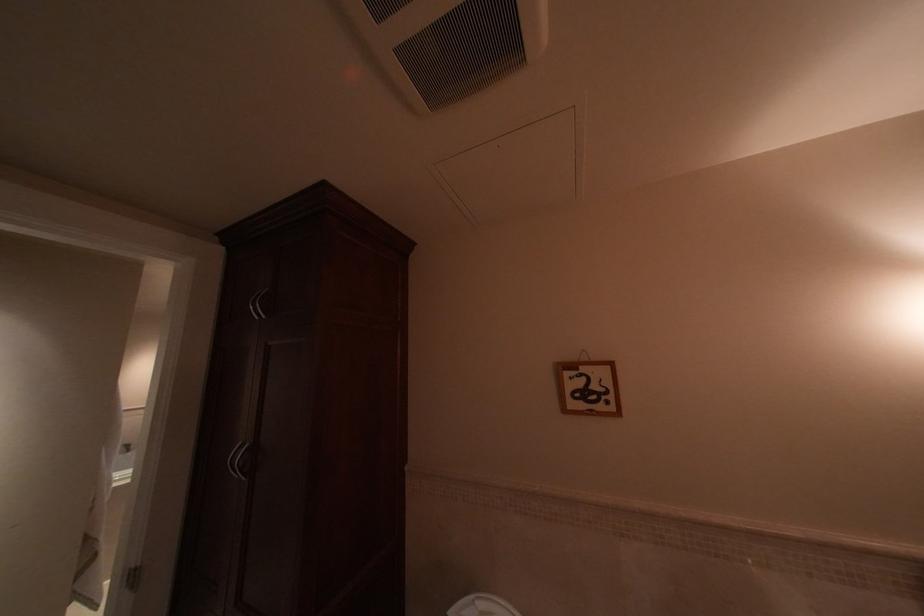
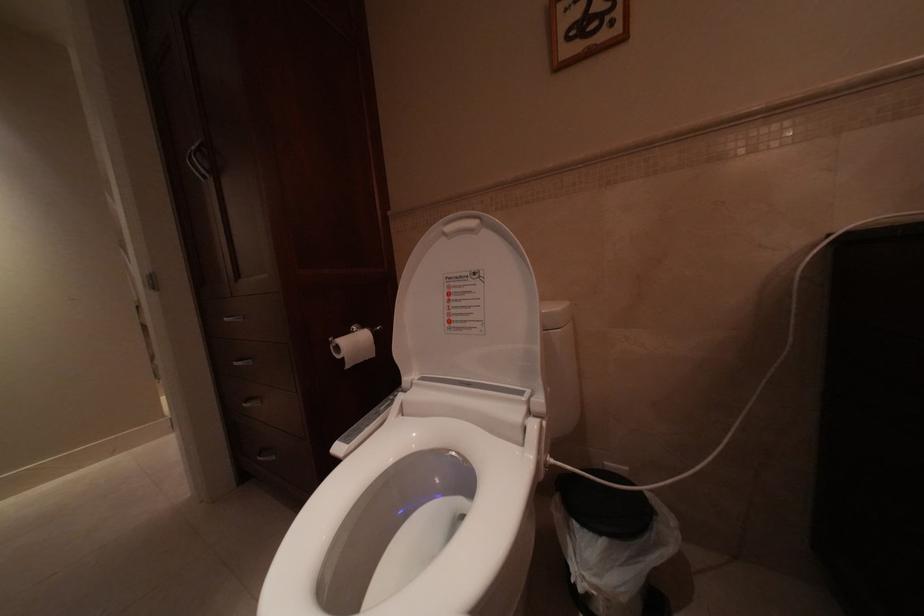
Question: The images are taken continuously from a first-person perspective. In which direction is your viewpoint rotating?

Choices:
 (A) Left
 (B) Right
 (C) Up
 (D) Down

Answer: (D)